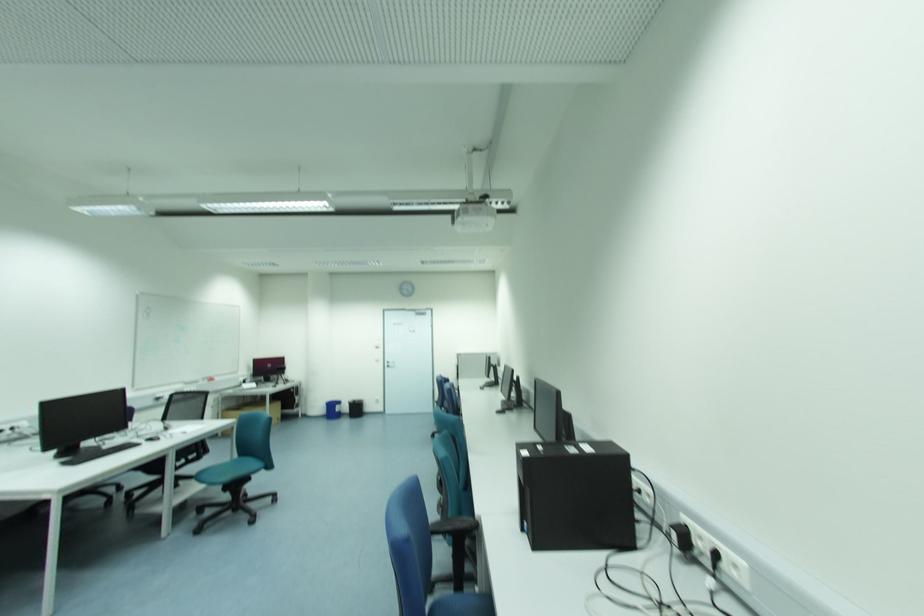
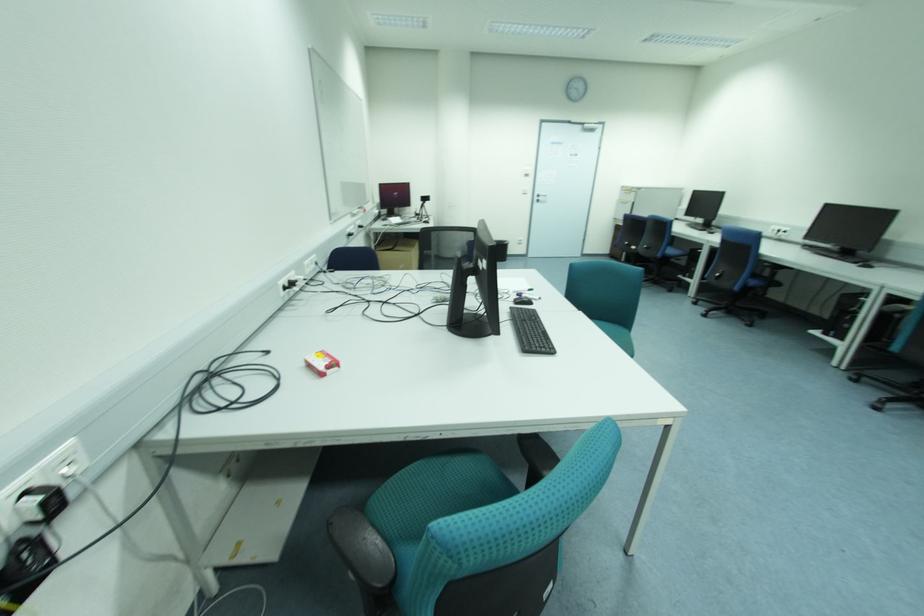
Based on the photo, the images are taken continuously from a first-person perspective. In which direction are you moving?

The cameraman walked toward left, forward.